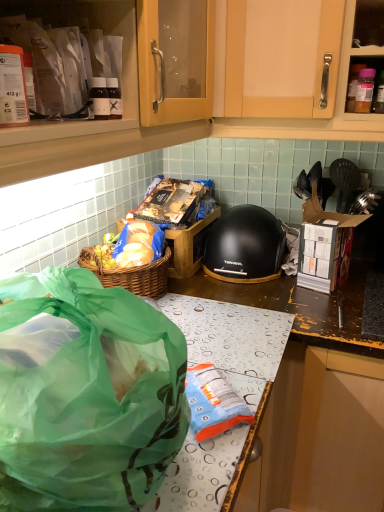
Question: Is black matte helmet at center a part of green translucent bag at lower left?

Choices:
 (A) no
 (B) yes

Answer: (A)

Question: From a real-world perspective, is green translucent bag at lower left positioned under black matte helmet at center based on gravity?

Choices:
 (A) yes
 (B) no

Answer: (B)

Question: From the image's perspective, is green translucent bag at lower left on top of black matte helmet at center?

Choices:
 (A) yes
 (B) no

Answer: (B)

Question: Does green translucent bag at lower left have a smaller size compared to black matte helmet at center?

Choices:
 (A) yes
 (B) no

Answer: (B)

Question: Is green translucent bag at lower left to the left of black matte helmet at center from the viewer's perspective?

Choices:
 (A) yes
 (B) no

Answer: (A)

Question: Is green translucent bag at lower left wider than black matte helmet at center?

Choices:
 (A) no
 (B) yes

Answer: (B)

Question: Can we say matte plastic container at upper left lies outside green translucent bag at lower left?

Choices:
 (A) yes
 (B) no

Answer: (A)

Question: Considering the relative sizes of matte plastic container at upper left and green translucent bag at lower left in the image provided, is matte plastic container at upper left shorter than green translucent bag at lower left?

Choices:
 (A) yes
 (B) no

Answer: (A)

Question: Are matte plastic container at upper left and green translucent bag at lower left making contact?

Choices:
 (A) yes
 (B) no

Answer: (B)

Question: Is matte plastic container at upper left positioned with its back to green translucent bag at lower left?

Choices:
 (A) no
 (B) yes

Answer: (A)

Question: Considering the relative sizes of matte plastic container at upper left and green translucent bag at lower left in the image provided, is matte plastic container at upper left taller than green translucent bag at lower left?

Choices:
 (A) no
 (B) yes

Answer: (A)

Question: Is matte plastic container at upper left to the right of green translucent bag at lower left from the viewer's perspective?

Choices:
 (A) yes
 (B) no

Answer: (B)

Question: Does matte plastic container at upper left have a smaller size compared to black matte helmet at center?

Choices:
 (A) no
 (B) yes

Answer: (B)